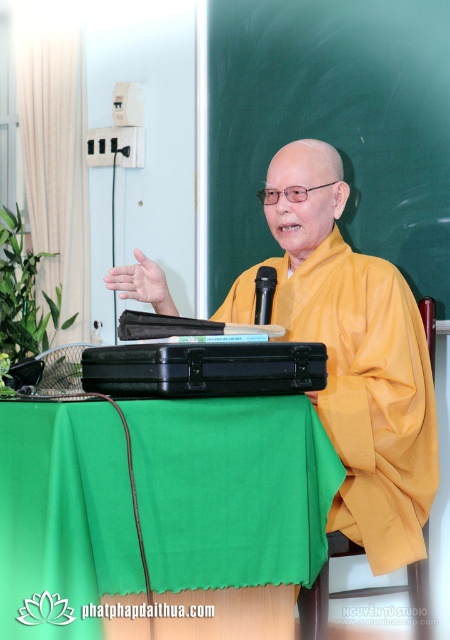
Is green fabric table at center smaller than yellow matte robe at center?

Correct, green fabric table at center occupies less space than yellow matte robe at center.

Between point (82, 444) and point (340, 518), which one is positioned behind?

The point (340, 518) is behind.

Which is behind, point (7, 589) or point (432, 493)?

The point (432, 493) is more distant.

Where is `green fabric table at center`? green fabric table at center is located at coordinates (232, 490).

Does green fabric table at center appear on the right side of black plastic microphone at center?

In fact, green fabric table at center is to the left of black plastic microphone at center.

Does green fabric table at center come behind black plastic microphone at center?

No, it is in front of black plastic microphone at center.

Is point (31, 460) farther from viewer compared to point (269, 272)?

No, it is not.

Find the location of a particular element. Image resolution: width=450 pixels, height=640 pixels. green fabric table at center is located at coordinates (232, 490).

Does yellow matte robe at center have a greater width compared to black plastic microphone at center?

Indeed, yellow matte robe at center has a greater width compared to black plastic microphone at center.

Consider the image. Between yellow matte robe at center and black plastic microphone at center, which one is positioned higher?

black plastic microphone at center is higher up.

Does point (387, 406) lie in front of point (269, 310)?

Yes, point (387, 406) is closer to viewer.

I want to click on yellow matte robe at center, so click(x=369, y=394).